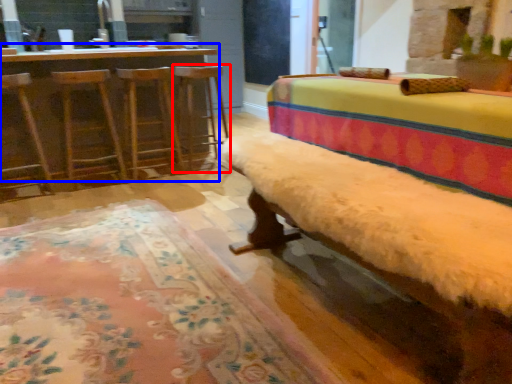
Question: Which object appears closest to the camera in this image, bar stool (highlighted by a red box) or table (highlighted by a blue box)?

Choices:
 (A) bar stool
 (B) table

Answer: (B)